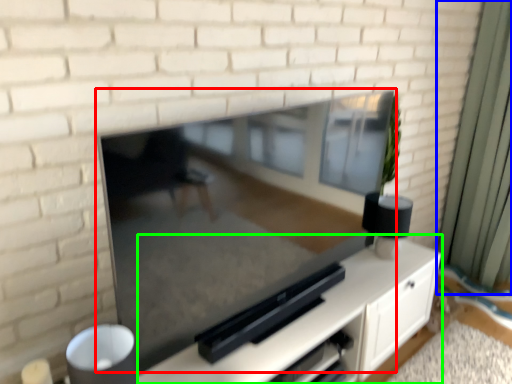
Question: Based on their relative distances, which object is farther from fireplace (highlighted by a red box)? Choose from curtain (highlighted by a blue box) and entertainment center (highlighted by a green box).

Choices:
 (A) curtain
 (B) entertainment center

Answer: (A)